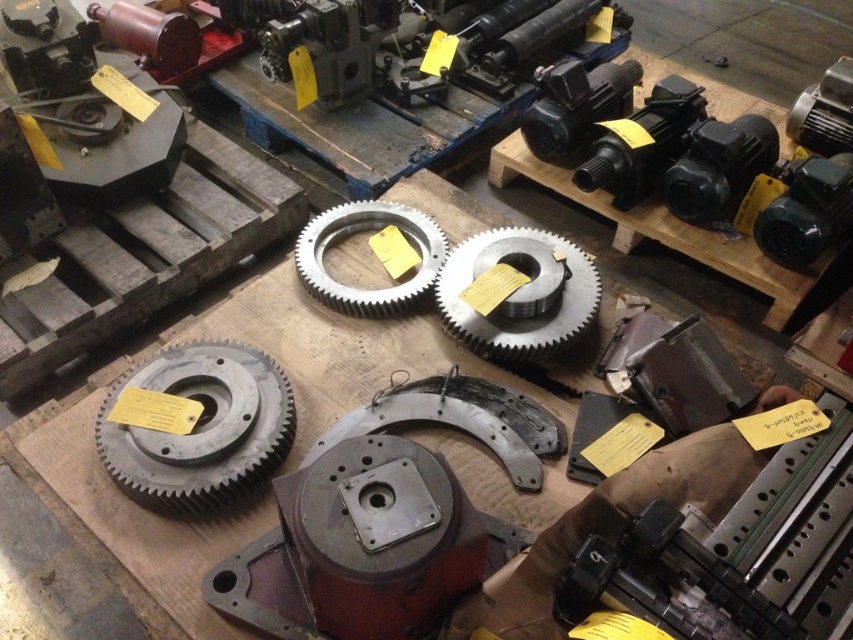
You are an inventory clerk in a workshop and need to place both the gray metallic gear at center and the matte gray gear at center into a storage box that can only hold one of them. Which gear should you choose to fit into the box?

The gray metallic gear at center is larger in size than the matte gray gear at center, so you should choose the matte gray gear at center to fit into the storage box.

You are an inventory manager in a workshop and need to determine the spatial relationship between the gray metallic gear at center and the matte gray gear at center. Which one is wider?

The gray metallic gear at center is wider than the matte gray gear at center according to the description.

You are standing in the workshop and see two points marked in the image. Which point, point (149, 445) or point (561, 323), is closer to you?

Point (149, 445) is closer to the viewer than point (561, 323).